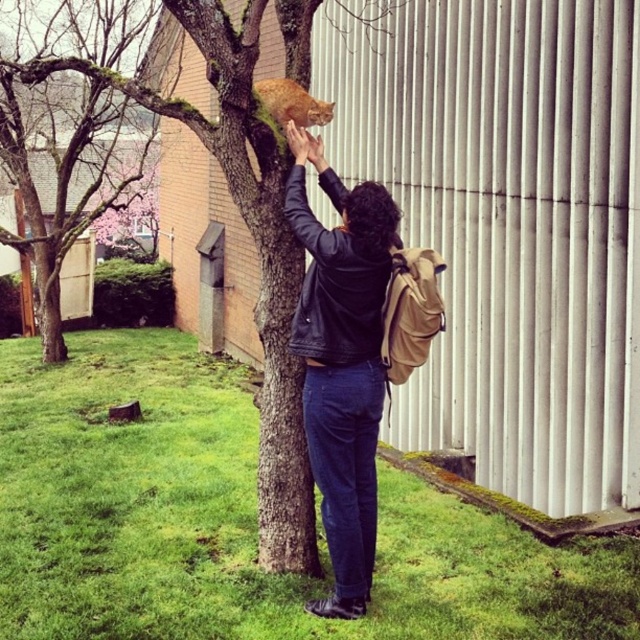
From the picture: Is green mossy tree at upper center to the right of black leather jacket at center from the viewer's perspective?

Incorrect, green mossy tree at upper center is not on the right side of black leather jacket at center.

Who is shorter, green mossy tree at upper center or black leather jacket at center?

With less height is black leather jacket at center.

Does point (307, 547) come farther from viewer compared to point (342, 419)?

Yes, point (307, 547) is farther from viewer.

You are a GUI agent. You are given a task and a screenshot of the screen. Output one action in this format:
    pyautogui.click(x=<x>, y=<y>)
    Task: Click on the green mossy tree at upper center
    The image size is (640, 640).
    Given the screenshot: What is the action you would take?
    pyautogui.click(x=259, y=252)

In the scene shown: Is green mossy tree at upper left bigger than orange fur cat at upper center?

No, green mossy tree at upper left is not bigger than orange fur cat at upper center.

Does green mossy tree at upper left have a lesser height compared to orange fur cat at upper center?

Indeed, green mossy tree at upper left has a lesser height compared to orange fur cat at upper center.

What do you see at coordinates (65, 125) in the screenshot? This screenshot has height=640, width=640. I see `green mossy tree at upper left` at bounding box center [65, 125].

Locate an element on the screen. The image size is (640, 640). green mossy tree at upper left is located at coordinates click(65, 125).

Can you confirm if green mossy tree at upper center is taller than orange fur cat at upper center?

Yes.

Which of these two, green mossy tree at upper center or orange fur cat at upper center, stands taller?

green mossy tree at upper center

Does point (252, 220) come farther from viewer compared to point (266, 80)?

No, it is not.

Where is `green mossy tree at upper center`? The image size is (640, 640). green mossy tree at upper center is located at coordinates (259, 252).